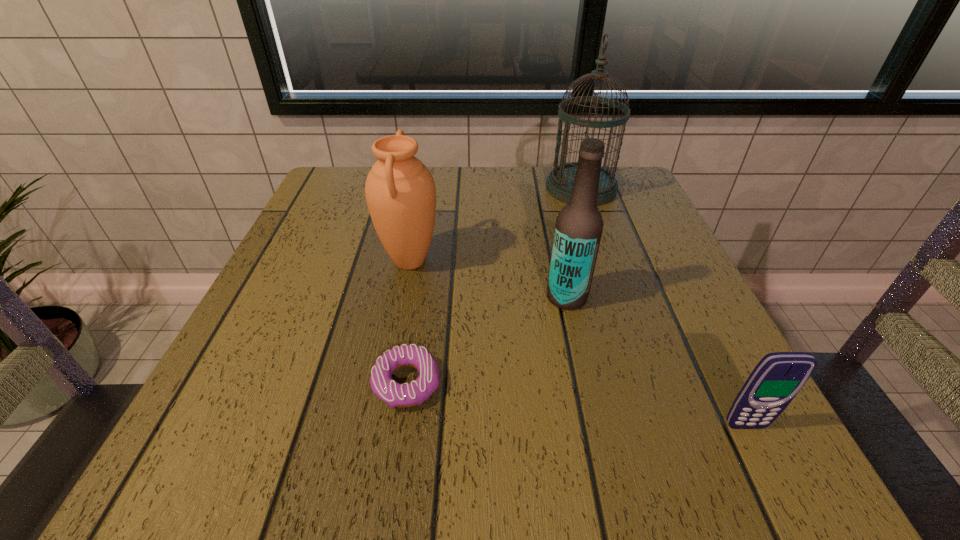
Locate an element on the screen. object identified as the second closest to the fourth farthest object is located at coordinates (578, 229).

Identify which object is the second closest to the farthest object. Please provide its 2D coordinates. Your answer should be formatted as a tuple, i.e. [(x, y)], where the tuple contains the x and y coordinates of a point satisfying the conditions above.

[(400, 191)]